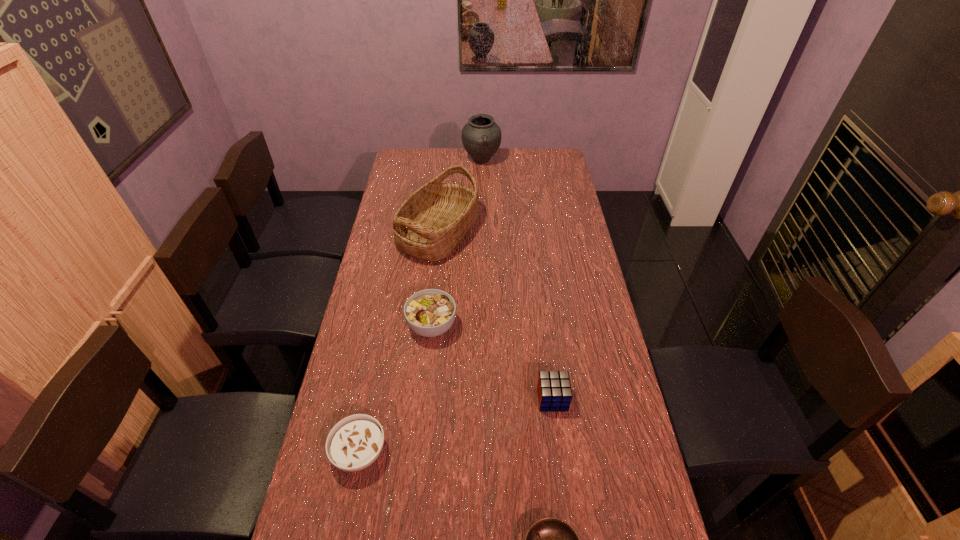
This screenshot has height=540, width=960. Find the location of `free space between the cube and the farthest object`. free space between the cube and the farthest object is located at coordinates (516, 280).

This screenshot has height=540, width=960. What are the coordinates of `vacant space that's between the cube and the basket` in the screenshot? It's located at (495, 316).

What are the coordinates of `free space between the basket and the fifth tallest object` in the screenshot? It's located at (399, 342).

Find the location of a particular element. Image resolution: width=960 pixels, height=540 pixels. vacant point located between the urn and the third nearest object is located at coordinates (516, 280).

The image size is (960, 540). In order to click on object that stands as the fifth closest to the basket in this screenshot , I will do `click(550, 539)`.

The width and height of the screenshot is (960, 540). Find the location of `the closest object to the urn`. the closest object to the urn is located at coordinates (430, 224).

The image size is (960, 540). I want to click on soup bowl that can be found as the closest to the second shortest object, so click(431, 312).

You are a GUI agent. You are given a task and a screenshot of the screen. Output one action in this format:
    pyautogui.click(x=<x>, y=<y>)
    Task: Click on the third closest soup bowl relative to the cube
    
    Given the screenshot: What is the action you would take?
    pyautogui.click(x=354, y=443)

I want to click on vacant space that satisfies the following two spatial constraints: 1. on the back side of the second farthest object; 2. on the left side of the second nearest soup bowl, so click(402, 233).

Where is `vacant space that satisfies the following two spatial constraints: 1. on the front side of the basket; 2. on the right side of the fourth nearest object`? Image resolution: width=960 pixels, height=540 pixels. vacant space that satisfies the following two spatial constraints: 1. on the front side of the basket; 2. on the right side of the fourth nearest object is located at coordinates (429, 326).